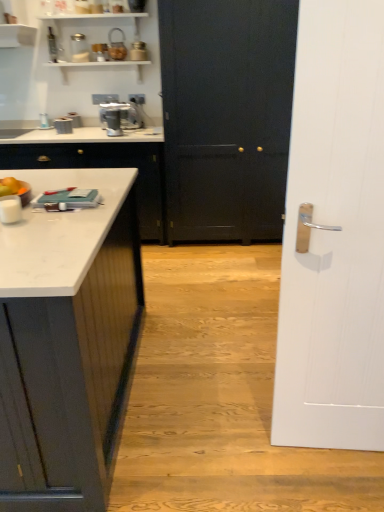
Question: Choose the correct answer: Is orange matte fruit at left inside white marble countertop at left or outside it?

Choices:
 (A) inside
 (B) outside

Answer: (B)

Question: Considering the positions of point (3, 192) and point (162, 186), is point (3, 192) closer or farther from the camera than point (162, 186)?

Choices:
 (A) farther
 (B) closer

Answer: (B)

Question: Which object is the farthest from the metallic silver coffee maker at upper center?

Choices:
 (A) orange matte fruit at left
 (B) metallic textured canister at upper center
 (C) white wood door at right, which appears as the 1th door when viewed from the front
 (D) black matte door at center, which is the 2th door from front to back
 (E) white marble countertop at left

Answer: (C)

Question: Estimate the real-world distances between objects in this image. Which object is closer to the white marble countertop at left?

Choices:
 (A) metallic silver coffee maker at upper center
 (B) white wood door at right, which appears as the 1th door when viewed from the front
 (C) black matte door at center, which ranks as the first door in back-to-front order
 (D) metallic textured canister at upper center
 (E) orange matte fruit at left

Answer: (A)